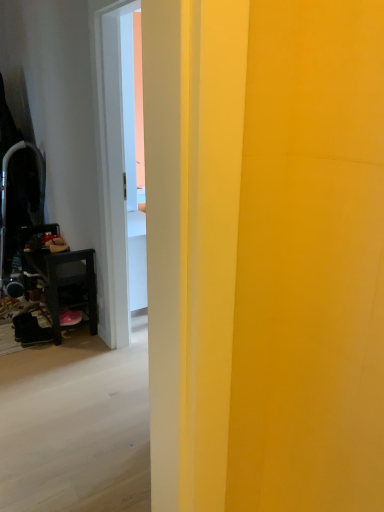
Question: Can you confirm if pink suede shoe at lower left, which is counted as the first footwear, starting from the right, is shorter than wooden dark brown table at left?

Choices:
 (A) yes
 (B) no

Answer: (A)

Question: Does pink suede shoe at lower left, the 2th footwear from the left, have a smaller size compared to wooden dark brown table at left?

Choices:
 (A) yes
 (B) no

Answer: (A)

Question: Is the position of pink suede shoe at lower left, the 2th footwear from the left, less distant than that of wooden dark brown table at left?

Choices:
 (A) yes
 (B) no

Answer: (B)

Question: Does pink suede shoe at lower left, the 2th footwear from the left, appear on the right side of wooden dark brown table at left?

Choices:
 (A) yes
 (B) no

Answer: (A)

Question: Is pink suede shoe at lower left, the 2th footwear from the left, facing away from wooden dark brown table at left?

Choices:
 (A) no
 (B) yes

Answer: (B)

Question: Considering their positions, is metallic black swivel chair at left located in front of or behind pink suede shoe at lower left, the 2th footwear from the left?

Choices:
 (A) front
 (B) behind

Answer: (B)

Question: In terms of width, does metallic black swivel chair at left look wider or thinner when compared to pink suede shoe at lower left, which is counted as the first footwear, starting from the right?

Choices:
 (A) wide
 (B) thin

Answer: (A)

Question: From their relative heights in the image, would you say metallic black swivel chair at left is taller or shorter than pink suede shoe at lower left, which is counted as the first footwear, starting from the right?

Choices:
 (A) tall
 (B) short

Answer: (A)

Question: From a real-world perspective, is metallic black swivel chair at left above or below pink suede shoe at lower left, which is counted as the first footwear, starting from the right?

Choices:
 (A) above
 (B) below

Answer: (A)

Question: In the image, is pink suede shoe at lower left, which is counted as the first footwear, starting from the right, on the left side or the right side of metallic black swivel chair at left?

Choices:
 (A) left
 (B) right

Answer: (B)

Question: Is pink suede shoe at lower left, the 2th footwear from the left, inside or outside of metallic black swivel chair at left?

Choices:
 (A) inside
 (B) outside

Answer: (B)

Question: From the image's perspective, is pink suede shoe at lower left, which is counted as the first footwear, starting from the right, positioned above or below metallic black swivel chair at left?

Choices:
 (A) below
 (B) above

Answer: (A)

Question: Considering the positions of pink suede shoe at lower left, the 2th footwear from the left, and metallic black swivel chair at left in the image, is pink suede shoe at lower left, the 2th footwear from the left, bigger or smaller than metallic black swivel chair at left?

Choices:
 (A) small
 (B) big

Answer: (A)

Question: Looking at their shapes, would you say pink suede shoe at lower left, which is counted as the first footwear, starting from the right, is wider or thinner than black suede boot at lower left, the 1th footwear from the left?

Choices:
 (A) wide
 (B) thin

Answer: (B)

Question: In the image, is pink suede shoe at lower left, the 2th footwear from the left, positioned in front of or behind black suede boot at lower left, the 1th footwear from the left?

Choices:
 (A) behind
 (B) front

Answer: (A)